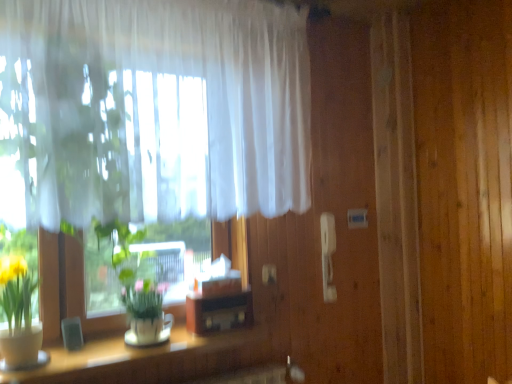
Question: In terms of height, does wooden table at lower left look taller or shorter compared to white sheer curtain at upper left?

Choices:
 (A) tall
 (B) short

Answer: (B)

Question: From the image's perspective, is wooden table at lower left positioned above or below white sheer curtain at upper left?

Choices:
 (A) below
 (B) above

Answer: (A)

Question: Is wooden table at lower left spatially inside white sheer curtain at upper left, or outside of it?

Choices:
 (A) outside
 (B) inside

Answer: (A)

Question: Is white sheer curtain at upper left wider or thinner than wooden table at lower left?

Choices:
 (A) wide
 (B) thin

Answer: (B)

Question: From the image's perspective, relative to wooden table at lower left, is white sheer curtain at upper left above or below?

Choices:
 (A) below
 (B) above

Answer: (B)

Question: Considering the positions of white sheer curtain at upper left and wooden table at lower left in the image, is white sheer curtain at upper left taller or shorter than wooden table at lower left?

Choices:
 (A) short
 (B) tall

Answer: (B)

Question: Would you say white sheer curtain at upper left is to the left or to the right of wooden table at lower left in the picture?

Choices:
 (A) right
 (B) left

Answer: (A)